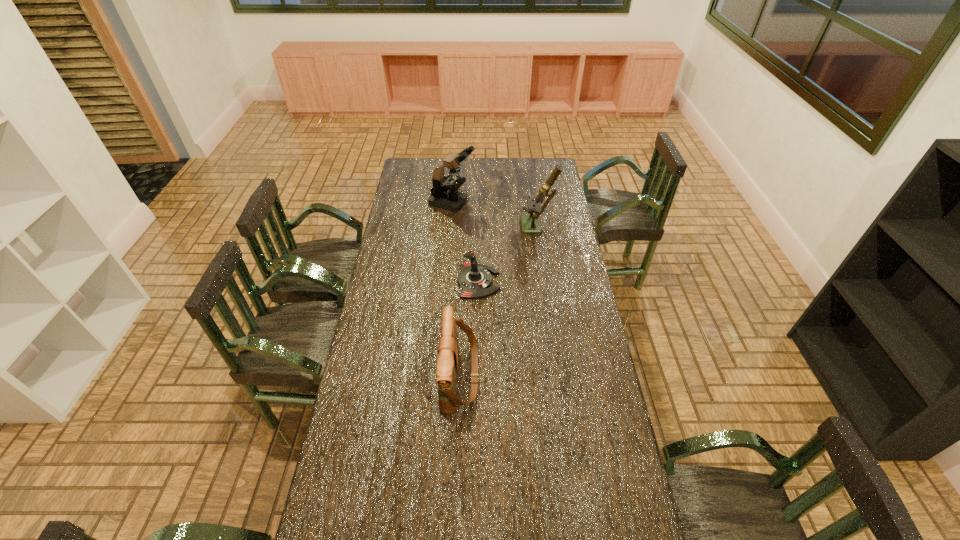
The width and height of the screenshot is (960, 540). I want to click on free space located at the eyepiece of the nearer microscope, so click(x=507, y=227).

Identify the location of free location located 0.270m at the eyepiece of the nearer microscope. (468, 227).

Locate an element on the screen. The image size is (960, 540). vacant region located 0.180m on the front-facing side of the nearest object is located at coordinates tap(529, 376).

Image resolution: width=960 pixels, height=540 pixels. Identify the location of free space located on the handle side of the joystick. (564, 282).

Locate an element on the screen. object positioned at the right edge is located at coordinates 530,224.

Where is `free location at the left edge of the desktop`? free location at the left edge of the desktop is located at coordinates (410, 181).

The image size is (960, 540). I want to click on free region at the right edge, so click(x=591, y=326).

Find the location of a particular element. The image size is (960, 540). vacant space at the far right corner is located at coordinates (531, 178).

You are a GUI agent. You are given a task and a screenshot of the screen. Output one action in this format:
    pyautogui.click(x=<x>, y=<y>)
    Task: Click on the unoccupied position between the second farthest object and the shortest object
    This screenshot has width=960, height=540.
    Given the screenshot: What is the action you would take?
    pyautogui.click(x=508, y=255)

This screenshot has height=540, width=960. I want to click on free space between the third nearest object and the shortest object, so click(508, 255).